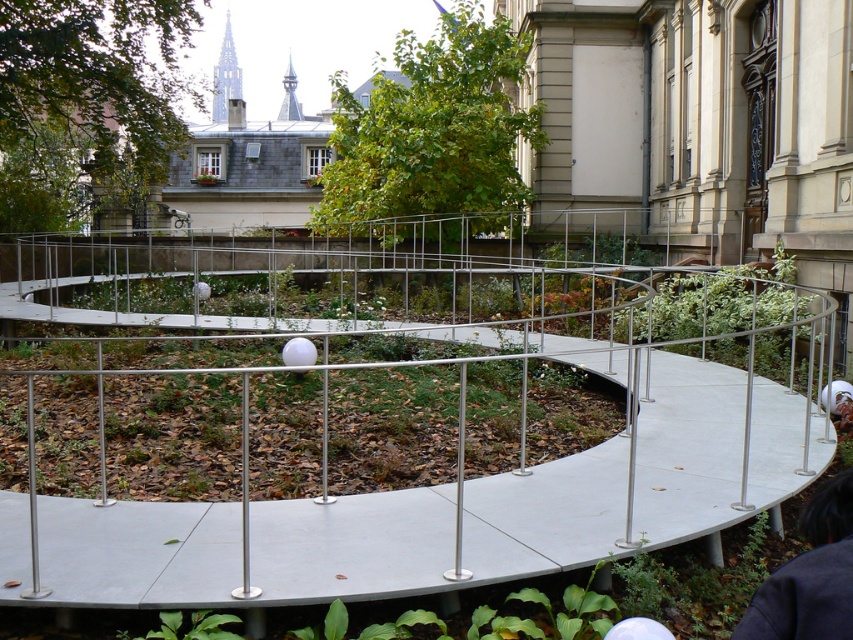
Question: Is metallic silver fence at center behind white matte helmet at center?

Choices:
 (A) no
 (B) yes

Answer: (A)

Question: Among these points, which one is nearest to the camera?

Choices:
 (A) (840, 413)
 (B) (181, 472)

Answer: (B)

Question: Does dark blue fabric at lower right lie behind white matte helmet at center?

Choices:
 (A) no
 (B) yes

Answer: (A)

Question: Does metallic silver fence at center come in front of white matte helmet at center?

Choices:
 (A) no
 (B) yes

Answer: (B)

Question: Which point is farther from the camera taking this photo?

Choices:
 (A) (763, 608)
 (B) (489, 276)

Answer: (B)

Question: Among these points, which one is farthest from the camera?

Choices:
 (A) (840, 417)
 (B) (822, 548)

Answer: (A)